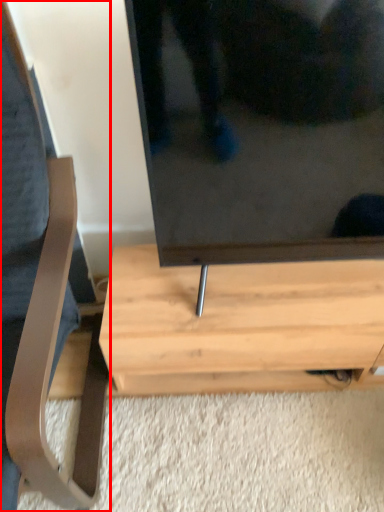
Question: From the image's perspective, what is the correct spatial relationship of furniture (annotated by the red box) in relation to table?

Choices:
 (A) below
 (B) above

Answer: (B)